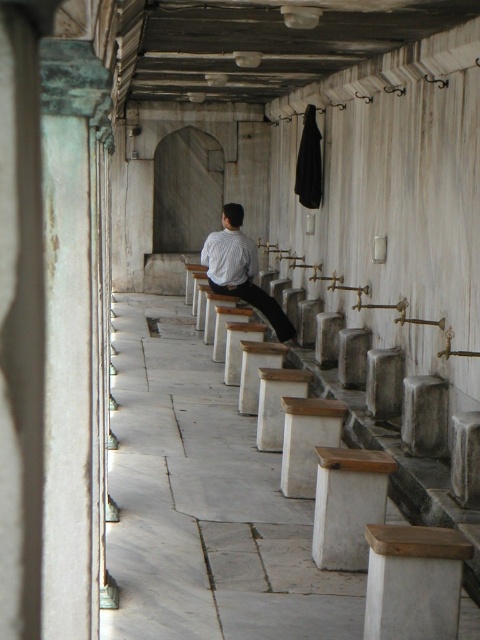
Is point (197, 512) behind point (227, 237)?

That is False.

The height and width of the screenshot is (640, 480). In order to click on white marble bench at center in this screenshot , I will do `click(204, 502)`.

Measure the distance between white marble bench at center and camera.

6.26 meters

You are a GUI agent. You are given a task and a screenshot of the screen. Output one action in this format:
    pyautogui.click(x=<x>, y=<y>)
    Task: Click on the white marble bench at center
    This screenshot has height=640, width=480.
    Given the screenshot: What is the action you would take?
    pyautogui.click(x=204, y=502)